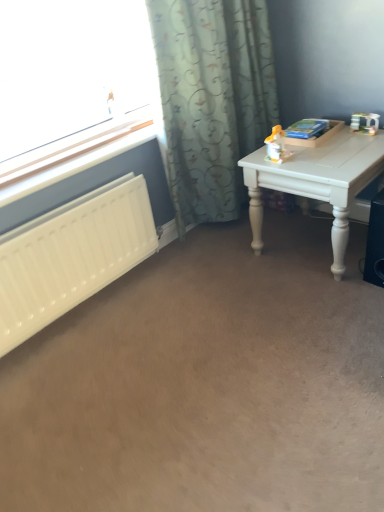
This screenshot has height=512, width=384. Find the location of `free location to the left of black plastic speaker at lower right`. free location to the left of black plastic speaker at lower right is located at coordinates (334, 280).